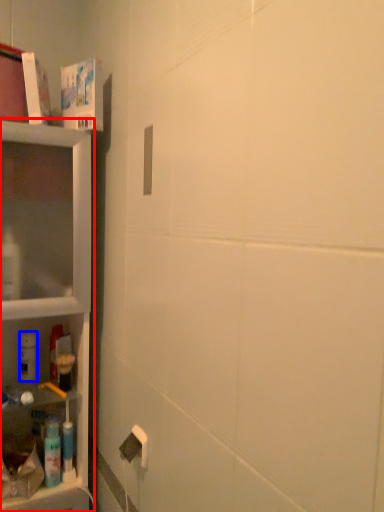
Question: Among these objects, which one is farthest to the camera, shelf (highlighted by a red box) or cleaning product (highlighted by a blue box)?

Choices:
 (A) shelf
 (B) cleaning product

Answer: (B)